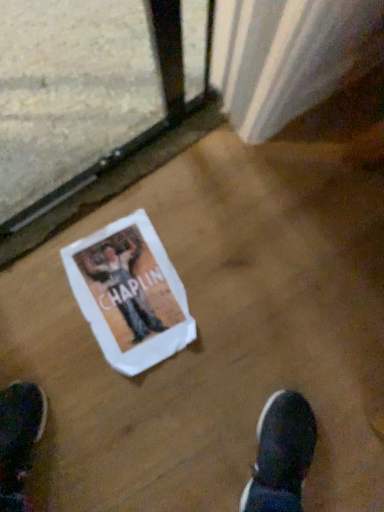
Identify the location of vacant region to the left of white paper flyer at center. (40, 307).